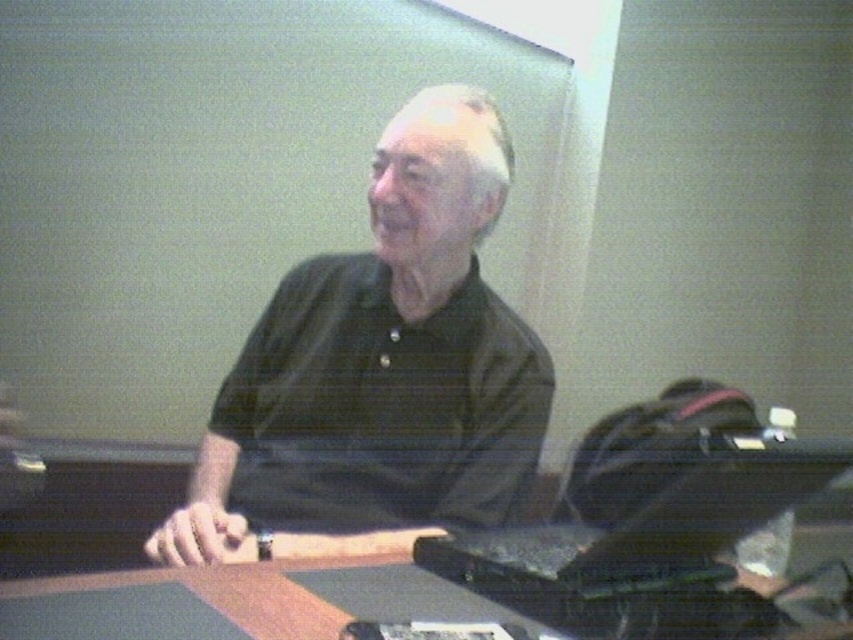
Is black matte shirt at center bigger than black textured laptop at center?

Indeed, black matte shirt at center has a larger size compared to black textured laptop at center.

Can you confirm if black matte shirt at center is positioned to the left of black textured laptop at center?

Correct, you'll find black matte shirt at center to the left of black textured laptop at center.

Image resolution: width=853 pixels, height=640 pixels. What do you see at coordinates (386, 355) in the screenshot?
I see `black matte shirt at center` at bounding box center [386, 355].

At what (x,y) coordinates should I click in order to perform the action: click on black matte shirt at center. Please return your answer as a coordinate pair (x, y). Looking at the image, I should click on (386, 355).

Who is taller, black textured laptop at center or smooth wooden table at center?

black textured laptop at center is taller.

Can you confirm if black textured laptop at center is positioned to the left of smooth wooden table at center?

No, black textured laptop at center is not to the left of smooth wooden table at center.

Locate an element on the screen. The image size is (853, 640). black textured laptop at center is located at coordinates (650, 520).

Can you confirm if black matte shirt at center is wider than smooth wooden table at center?

Yes, black matte shirt at center is wider than smooth wooden table at center.

Who is shorter, black matte shirt at center or smooth wooden table at center?

With less height is smooth wooden table at center.

Where is `black matte shirt at center`? Image resolution: width=853 pixels, height=640 pixels. black matte shirt at center is located at coordinates click(386, 355).